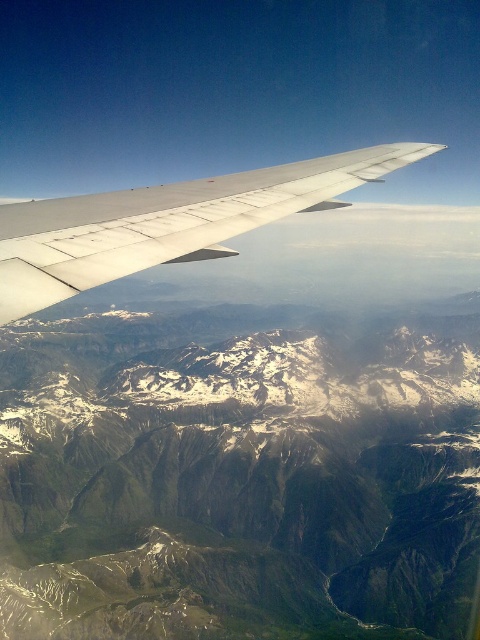
You are a passenger on an airplane looking out the window. You notice two points in the mountainous landscape below. The first point is at coordinates point (315, 589) and the second is at point (46, 220). Which point is closer to the airplane?

Point (315, 589) is closer to the airplane because it is further to the viewer than point (46, 220).

Consider the image. You are a passenger on an airplane and looking out the window. You see the snowy rocky mountains at upper center and the silver metallic wing at upper center. Which object is closer to you?

The silver metallic wing at upper center is closer to you because it is positioned over the snowy rocky mountains at upper center, indicating it is in front of them from your viewpoint.